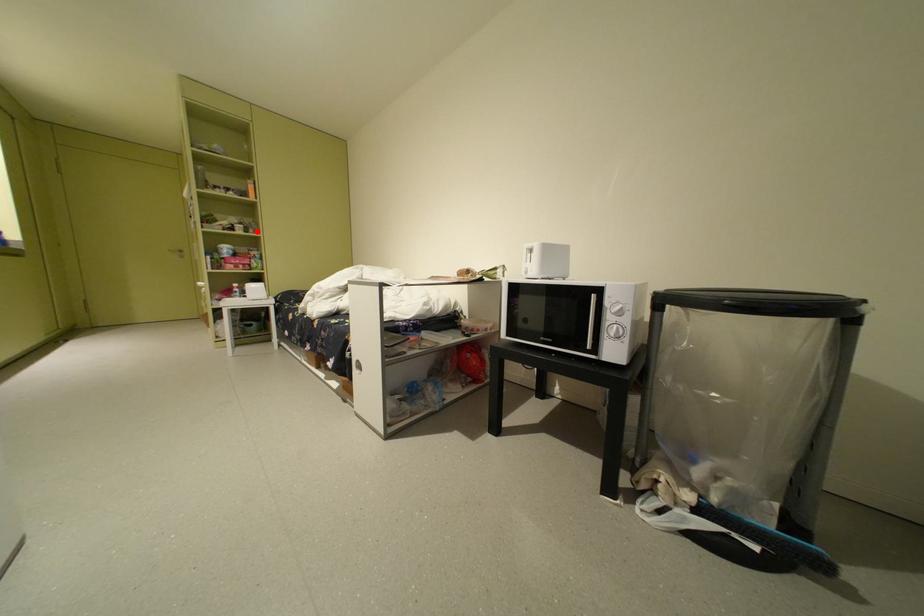
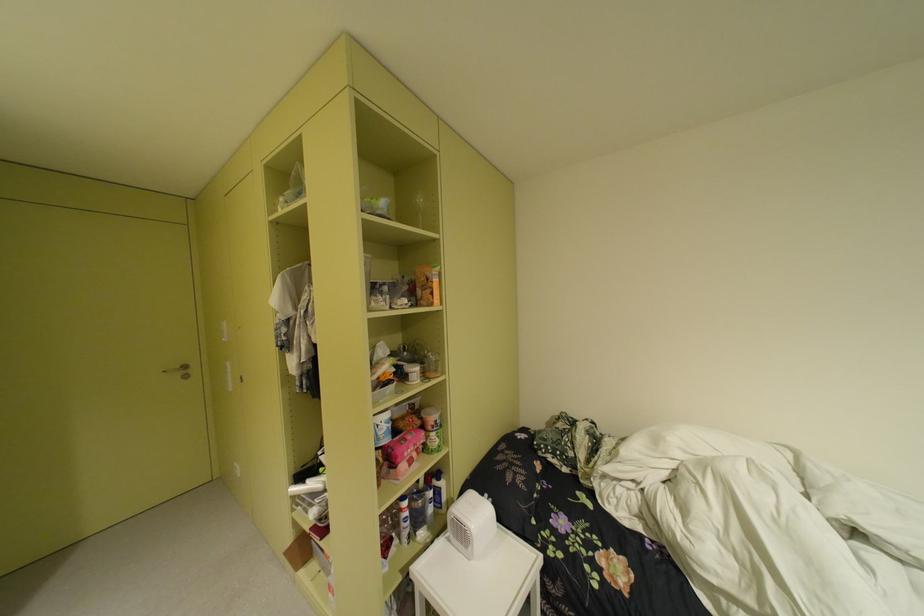
Find the pixel in the second image that matches the highlighted location in the first image.

(434, 376)